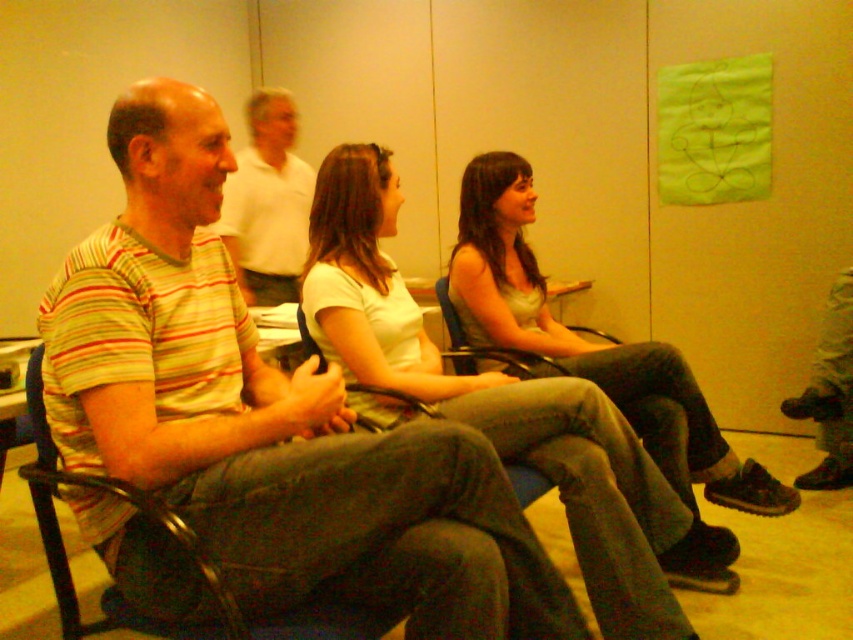
In the scene shown: You are organizing a charity clothing drive and need to categorize the striped cotton shirts based on their size. Given that the striped cotton shirt at left is larger than the striped cotton shirt at center, which one should be placed in the large size bin?

The striped cotton shirt at left should be placed in the large size bin because it has a larger size compared to the striped cotton shirt at center.

You are a photographer setting up a shoot in the scene. You need to ensure that the striped cotton shirt at left and the white cotton shirt at center are both visible in the frame. Given their positions, which shirt should you focus on first to ensure both are in focus?

The striped cotton shirt at left is below the white cotton shirt at center, so focusing on the white cotton shirt at center first would help ensure both are in focus as the striped cotton shirt at left is lower in the frame.

You are standing in the room and want to hand a document to the person wearing the striped cotton shirt at center. Which direction should you move to reach them first, considering the white cotton shirt at center is blocking your path?

The striped cotton shirt at center is behind the white cotton shirt at center, so you should move around the side of the white cotton shirt at center to reach the striped cotton shirt at center.